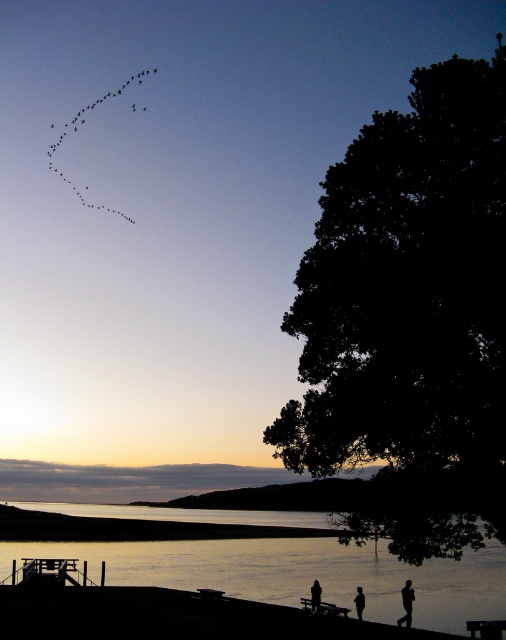
Question: Does silvery reflective water at lower center have a greater width compared to black matte person at lower center?

Choices:
 (A) no
 (B) yes

Answer: (B)

Question: From the image, what is the correct spatial relationship of silhouette running man at lower right in relation to silhouette figure at lower center?

Choices:
 (A) right
 (B) left

Answer: (A)

Question: Which object is positioned closest to the silhouette running man at lower right?

Choices:
 (A) silhouette figure at lower center
 (B) silvery reflective water at lower center
 (C) black matte birds at upper left

Answer: (A)

Question: Which of the following is the farthest from the observer?

Choices:
 (A) (358, 602)
 (B) (286, 422)
 (C) (409, 618)
 (D) (102, 556)

Answer: (D)

Question: Is black matte birds at upper left closer to camera compared to silhouette running man at lower right?

Choices:
 (A) yes
 (B) no

Answer: (B)

Question: Considering the real-world distances, which object is farthest from the dark silhouette tree at right?

Choices:
 (A) silhouette running man at lower right
 (B) silhouette figure at lower center
 (C) silvery reflective water at lower center
 (D) black matte person at lower center

Answer: (C)